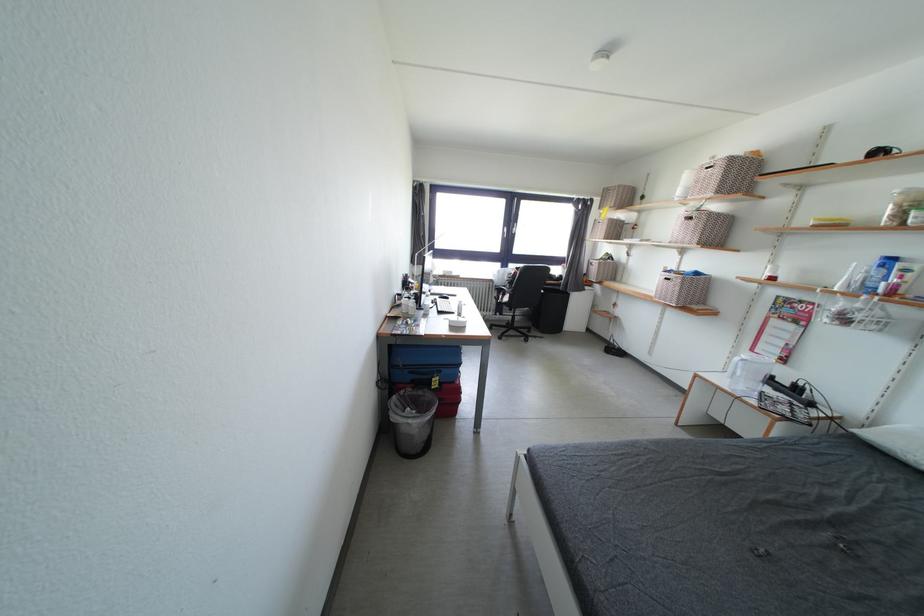
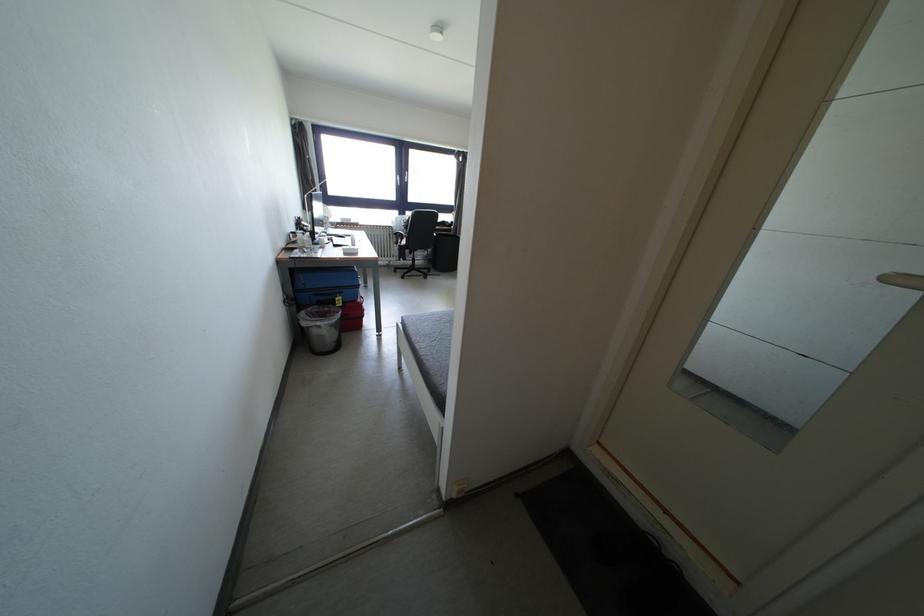
The point at (525, 463) is marked in the first image. Where is the corresponding point in the second image?

(403, 330)